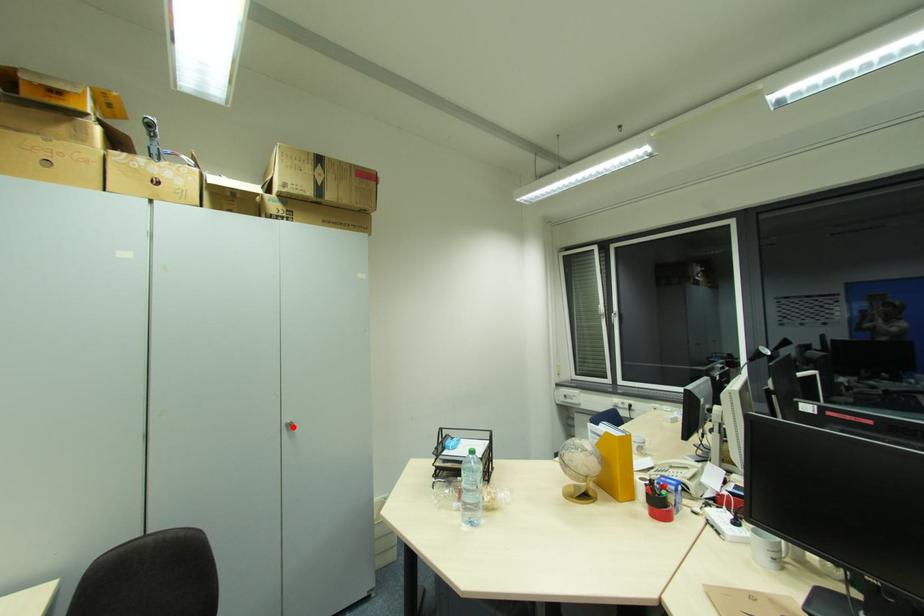
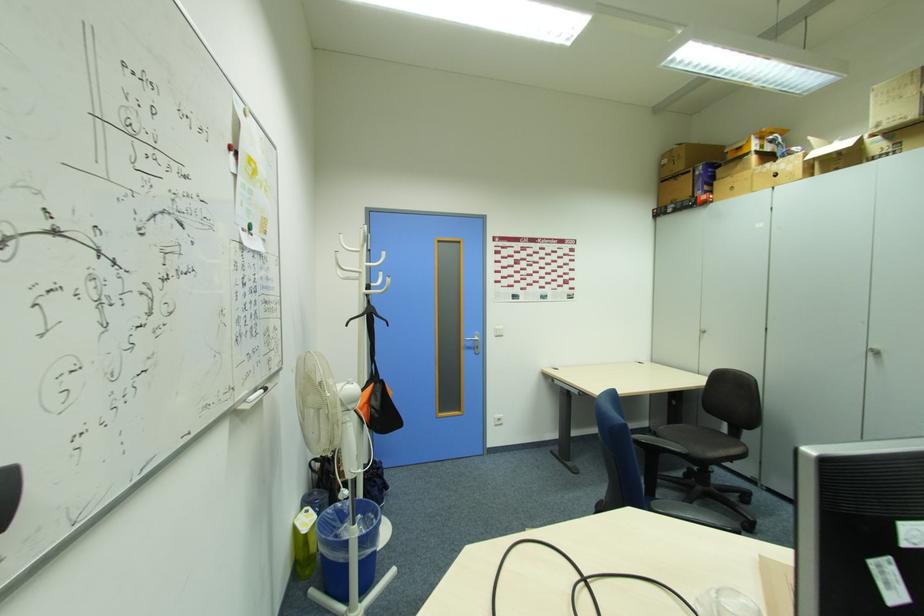
In the second image, find the point that corresponds to the highlighted location in the first image.

(880, 354)